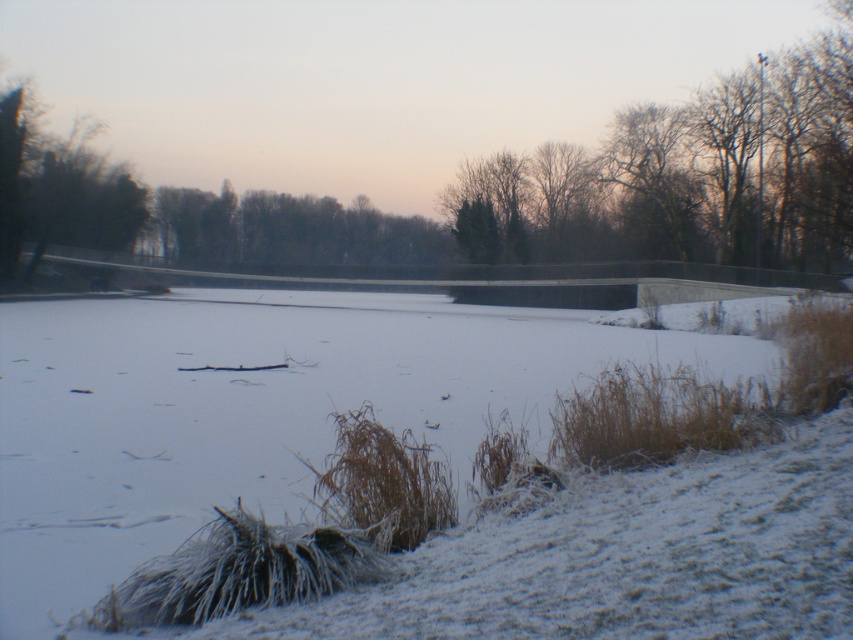
Does bare branches at upper center have a smaller size compared to green leafy trees at center?

No.

Who is shorter, bare branches at upper center or green leafy trees at center?

green leafy trees at center

I want to click on bare branches at upper center, so click(x=686, y=176).

Is point (672, 193) more distant than point (16, 173)?

Yes, point (672, 193) is behind point (16, 173).

Is bare branches at upper center bigger than green leafy tree at left?

Correct, bare branches at upper center is larger in size than green leafy tree at left.

Image resolution: width=853 pixels, height=640 pixels. What do you see at coordinates (686, 176) in the screenshot?
I see `bare branches at upper center` at bounding box center [686, 176].

Locate an element on the screen. Image resolution: width=853 pixels, height=640 pixels. bare branches at upper center is located at coordinates (686, 176).

Which of these two, green leafy trees at center or green leafy tree at left, stands shorter?

green leafy trees at center is shorter.

Does green leafy trees at center have a larger size compared to green leafy tree at left?

Yes.

Where is `green leafy trees at center`? green leafy trees at center is located at coordinates (291, 228).

What are the coordinates of `green leafy trees at center` in the screenshot? It's located at (291, 228).